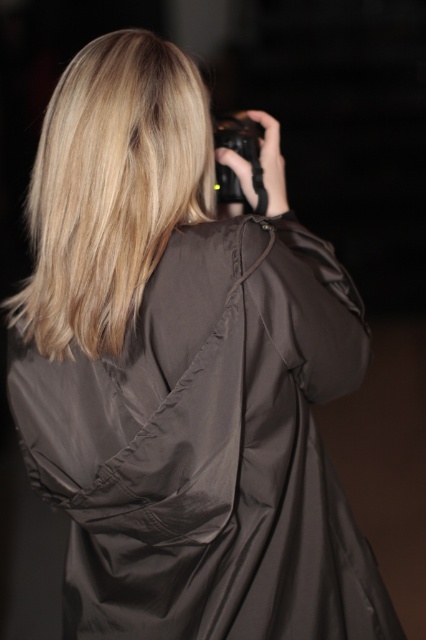
Question: Considering the relative positions of matte black dress at center and blonde silky hair at upper center in the image provided, where is matte black dress at center located with respect to blonde silky hair at upper center?

Choices:
 (A) right
 (B) left

Answer: (A)

Question: Among these objects, which one is farthest from the camera?

Choices:
 (A) black rubber camera at upper center
 (B) matte black dress at center
 (C) blonde silky hair at upper center

Answer: (A)

Question: Observing the image, what is the correct spatial positioning of matte black dress at center in reference to blonde silky hair at upper center?

Choices:
 (A) above
 (B) below

Answer: (B)

Question: Which point appears closest to the camera in this image?

Choices:
 (A) (224, 520)
 (B) (261, 129)
 (C) (157, 109)

Answer: (A)

Question: Is matte black dress at center positioned at the back of black rubber camera at upper center?

Choices:
 (A) yes
 (B) no

Answer: (B)

Question: Which point is closer to the camera?

Choices:
 (A) blonde silky hair at upper center
 (B) matte black dress at center
 (C) black rubber camera at upper center

Answer: (B)